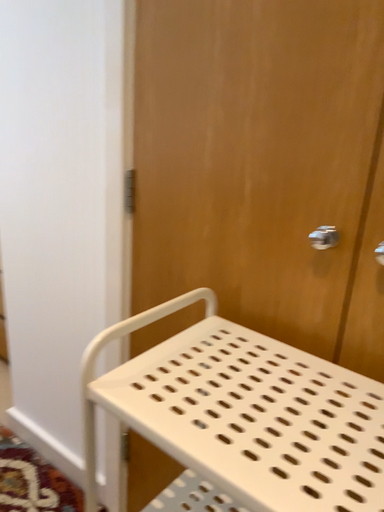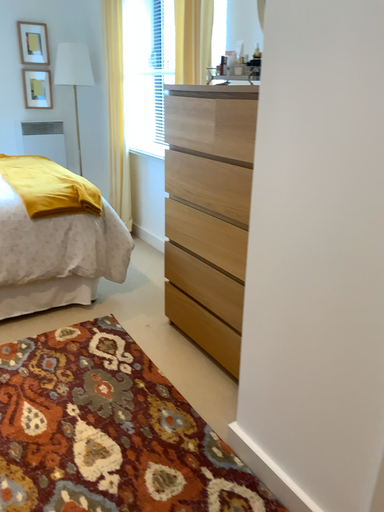
Question: Which way did the camera rotate in the video?

Choices:
 (A) rotated left
 (B) rotated right

Answer: (A)